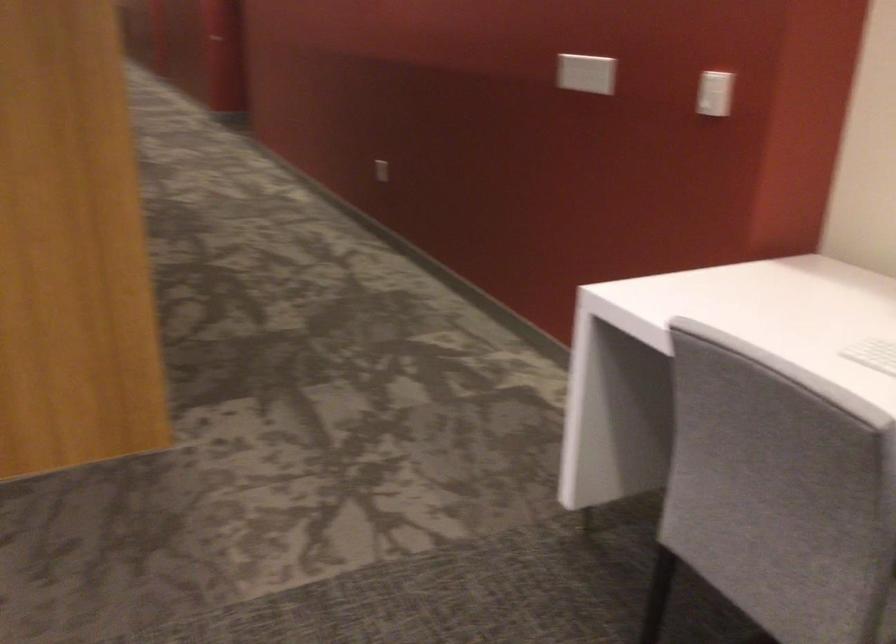
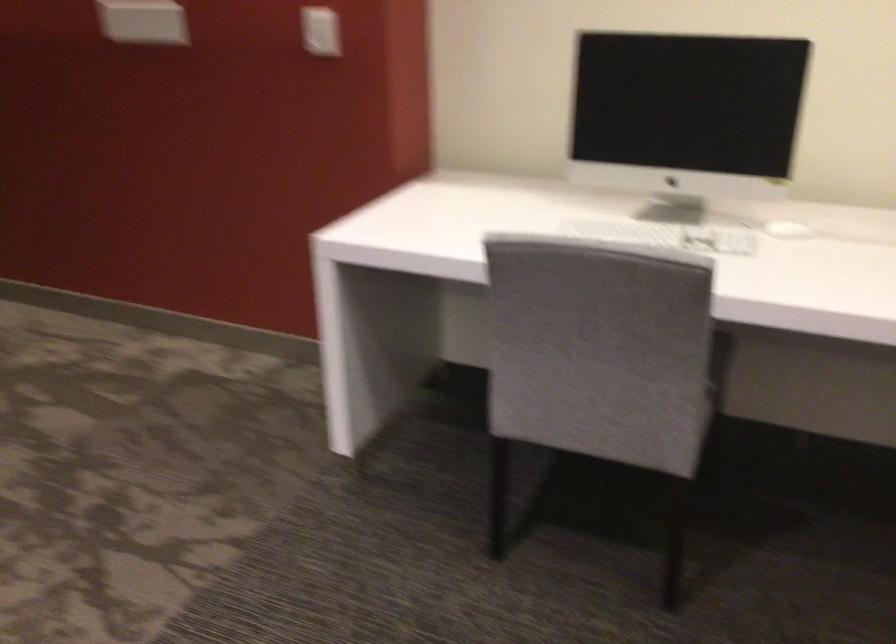
The point at (710, 90) is marked in the first image. Where is the corresponding point in the second image?

(321, 31)